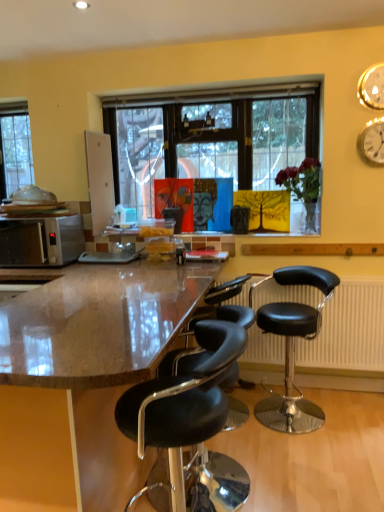
Question: Is black plastic radiator at lower right positioned in front of black leather stool at right, the 1th chair when ordered from back to front?

Choices:
 (A) no
 (B) yes

Answer: (A)

Question: Is black plastic radiator at lower right at the right side of black leather stool at right, acting as the 2th chair starting from the left?

Choices:
 (A) no
 (B) yes

Answer: (B)

Question: Is black plastic radiator at lower right at the left side of black leather stool at right, the 1th chair when ordered from back to front?

Choices:
 (A) no
 (B) yes

Answer: (A)

Question: Does black plastic radiator at lower right have a lesser height compared to black leather stool at right, the second chair in the front-to-back sequence?

Choices:
 (A) yes
 (B) no

Answer: (A)

Question: From the image's perspective, is black plastic radiator at lower right under black leather stool at right, which ranks as the first chair in right-to-left order?

Choices:
 (A) no
 (B) yes

Answer: (A)

Question: Is black plastic radiator at lower right smaller than black leather stool at right, which ranks as the first chair in right-to-left order?

Choices:
 (A) no
 (B) yes

Answer: (B)

Question: Considering the relative positions of blue textured canvas at center, which is the 1th person in right-to-left order, and black plastic radiator at lower right in the image provided, is blue textured canvas at center, which is the 1th person in right-to-left order, to the right of black plastic radiator at lower right from the viewer's perspective?

Choices:
 (A) yes
 (B) no

Answer: (B)

Question: Does blue textured canvas at center, positioned as the second person in left-to-right order, have a smaller size compared to black plastic radiator at lower right?

Choices:
 (A) yes
 (B) no

Answer: (A)

Question: Can you confirm if blue textured canvas at center, positioned as the second person in left-to-right order, is thinner than black plastic radiator at lower right?

Choices:
 (A) no
 (B) yes

Answer: (B)

Question: Is blue textured canvas at center, positioned as the second person in left-to-right order, behind black plastic radiator at lower right?

Choices:
 (A) yes
 (B) no

Answer: (A)

Question: Is blue textured canvas at center, which is the 1th person in right-to-left order, completely or partially outside of black plastic radiator at lower right?

Choices:
 (A) no
 (B) yes

Answer: (B)

Question: Is blue textured canvas at center, positioned as the second person in left-to-right order, wider than black plastic radiator at lower right?

Choices:
 (A) yes
 (B) no

Answer: (B)

Question: Is matte orange portrait at center, placed as the 1th person when sorted from left to right, at the left side of brown polished granite countertop at center?

Choices:
 (A) yes
 (B) no

Answer: (B)